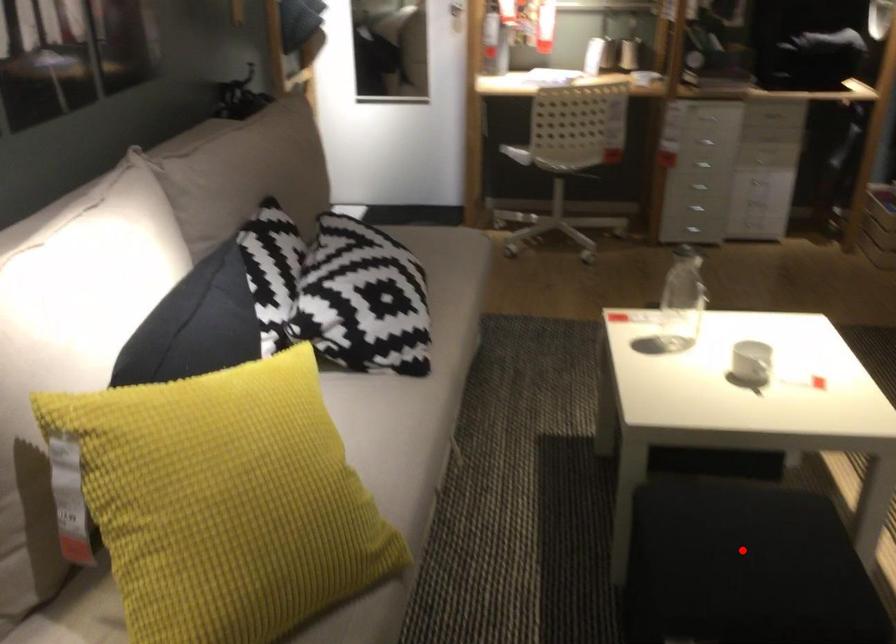
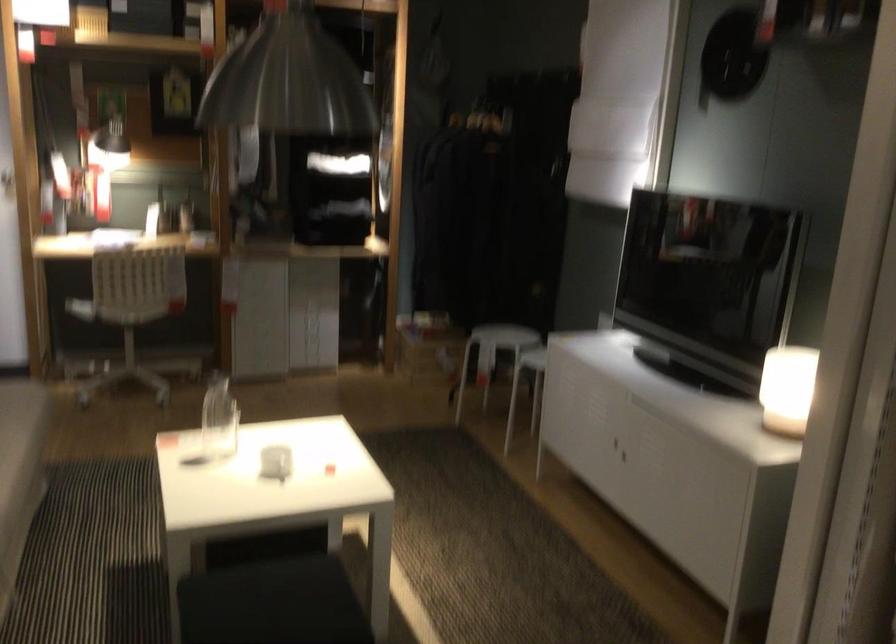
Find the pixel in the second image that matches the highlighted location in the first image.

(271, 603)